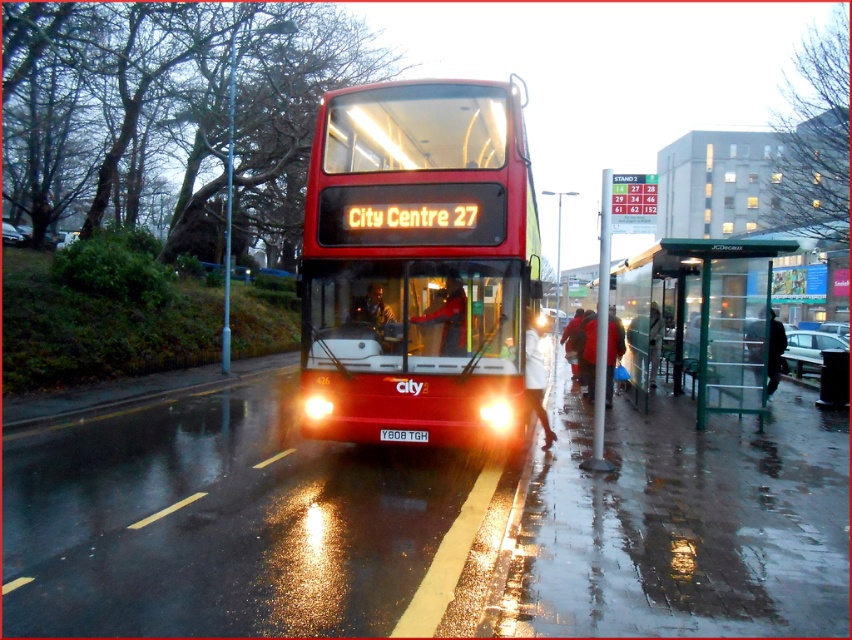
Which is more to the left, red wool coat at lower right or dark blue jacket at right?

red wool coat at lower right

Is red wool coat at lower right above dark blue jacket at right?

No, red wool coat at lower right is not above dark blue jacket at right.

The height and width of the screenshot is (640, 852). In order to click on red wool coat at lower right in this screenshot , I will do `click(585, 349)`.

Is red wool coat at lower right bigger than matte black jacket at center?

Indeed, red wool coat at lower right has a larger size compared to matte black jacket at center.

Who is more distant from viewer, [606,356] or [363,324]?

The point [606,356] is more distant.

You are a GUI agent. You are given a task and a screenshot of the screen. Output one action in this format:
    pyautogui.click(x=<x>, y=<y>)
    Task: Click on the red wool coat at lower right
    The width and height of the screenshot is (852, 640).
    Given the screenshot: What is the action you would take?
    pyautogui.click(x=585, y=349)

Can you confirm if white matte coat at lower center is positioned below white plastic license plate at center?

Actually, white matte coat at lower center is above white plastic license plate at center.

Is white matte coat at lower center further to the viewer compared to white plastic license plate at center?

Yes, white matte coat at lower center is behind white plastic license plate at center.

Which is in front, point (547, 442) or point (407, 440)?

Point (407, 440) is more forward.

The height and width of the screenshot is (640, 852). Identify the location of white matte coat at lower center. (534, 376).